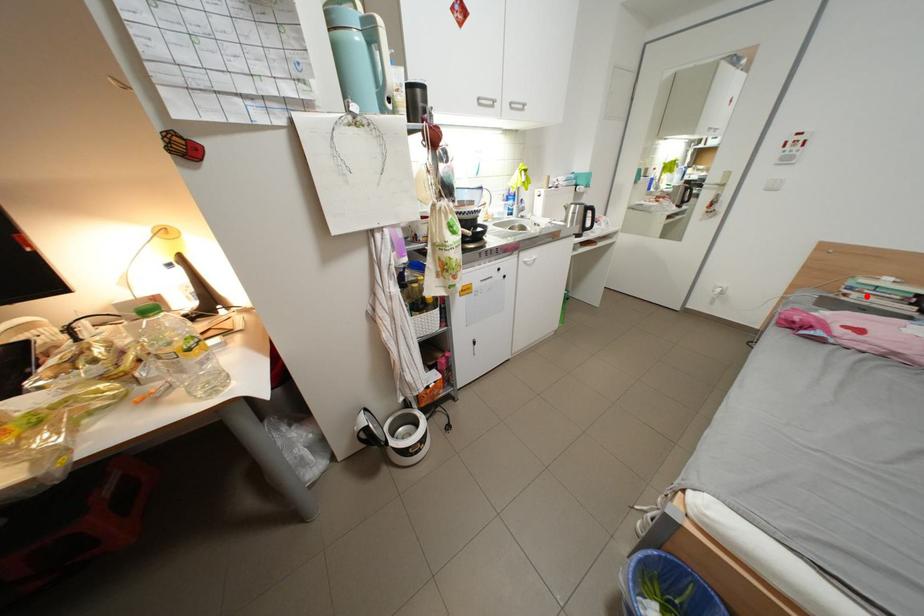
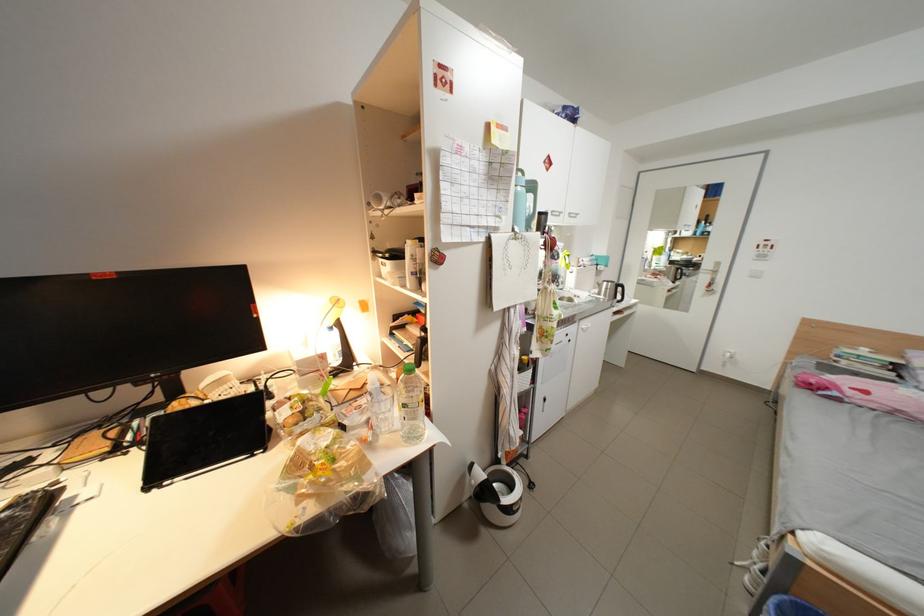
In the second image, find the point that corresponds to the highlighted location in the first image.

(856, 363)